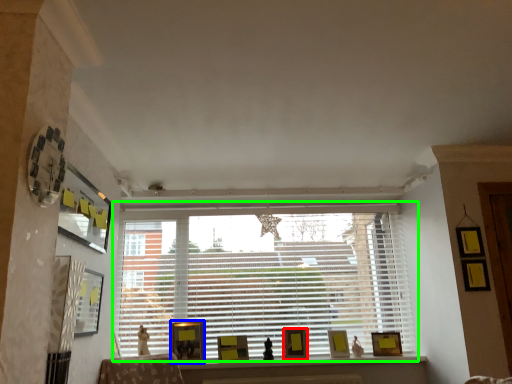
Question: Which object is positioned farthest from picture frame (highlighted by a red box)? Select from picture frame (highlighted by a blue box) and window (highlighted by a green box).

Choices:
 (A) picture frame
 (B) window

Answer: (A)